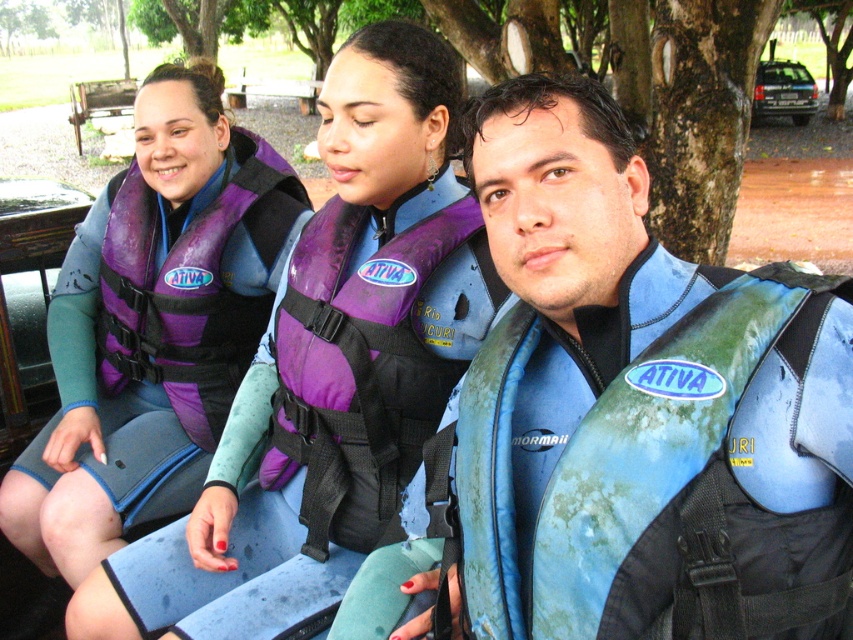
You are a lifeguard at the park. You see two purple matte life vests. Which one is closer to you, the purple matte life vest at left or the purple matte life vest at center?

The purple matte life vest at left is closer to you because it is in front of the purple matte life vest at center.

You are a lifeguard at the park and need to ensure that the purple matte life jacket at center and the purple matte life jacket at left are correctly sized for their wearers. Which life jacket has a smaller width?

The purple matte life jacket at center has a smaller width than the purple matte life jacket at left.